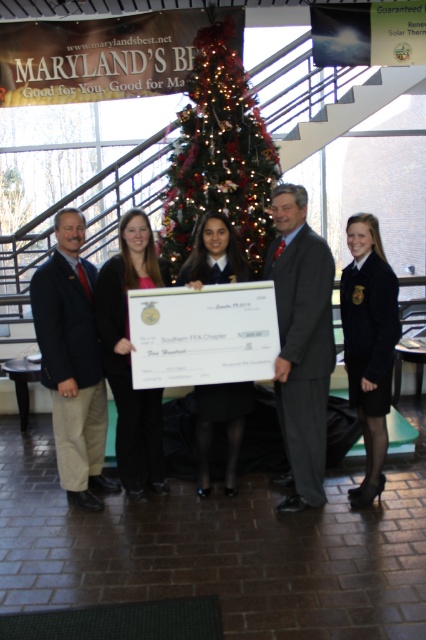
Question: Can you confirm if navy blue suit at center is smaller than matte black dress at center?

Choices:
 (A) yes
 (B) no

Answer: (B)

Question: Which point appears closest to the camera in this image?

Choices:
 (A) (244, 276)
 (B) (121, 422)
 (C) (192, 147)

Answer: (A)

Question: Can you confirm if shiny red christmas tree at center is positioned below navy blue suit at center?

Choices:
 (A) no
 (B) yes

Answer: (A)

Question: Does dark gray suit at center have a greater width compared to matte black dress at center?

Choices:
 (A) yes
 (B) no

Answer: (A)

Question: Which point appears closest to the camera in this image?

Choices:
 (A) click(x=134, y=288)
 (B) click(x=388, y=282)
 (C) click(x=302, y=333)
 (D) click(x=207, y=92)

Answer: (C)

Question: Among these points, which one is farthest from the camera?

Choices:
 (A) coord(141,474)
 (B) coord(48,307)
 (C) coord(356,321)

Answer: (A)